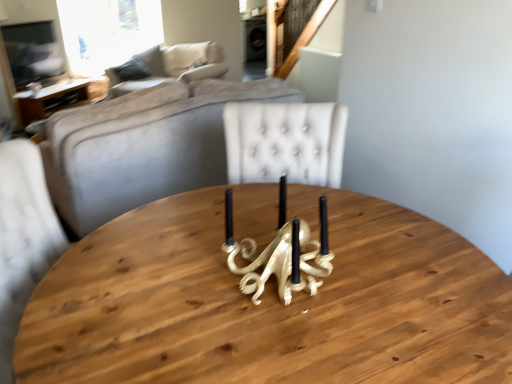
Question: From the image's perspective, would you say beige fabric couch at upper left is positioned over beige fabric pillow at upper center?

Choices:
 (A) yes
 (B) no

Answer: (B)

Question: From the image's perspective, is beige fabric couch at upper left located beneath beige fabric pillow at upper center?

Choices:
 (A) yes
 (B) no

Answer: (A)

Question: Is beige fabric couch at upper left beside beige fabric pillow at upper center?

Choices:
 (A) no
 (B) yes

Answer: (B)

Question: From a real-world perspective, is beige fabric couch at upper left physically above beige fabric pillow at upper center?

Choices:
 (A) yes
 (B) no

Answer: (B)

Question: Could you tell me if beige fabric couch at upper left is facing beige fabric pillow at upper center?

Choices:
 (A) no
 (B) yes

Answer: (A)

Question: Is beige fabric couch at upper left behind beige fabric pillow at upper center?

Choices:
 (A) no
 (B) yes

Answer: (A)

Question: Does wooden table at left lie in front of beige fabric pillow at upper center?

Choices:
 (A) no
 (B) yes

Answer: (B)

Question: Is wooden table at left outside beige fabric pillow at upper center?

Choices:
 (A) yes
 (B) no

Answer: (A)

Question: Considering the relative sizes of wooden table at left and beige fabric pillow at upper center in the image provided, is wooden table at left smaller than beige fabric pillow at upper center?

Choices:
 (A) yes
 (B) no

Answer: (B)

Question: Could you tell me if wooden table at left is facing beige fabric pillow at upper center?

Choices:
 (A) yes
 (B) no

Answer: (B)

Question: Considering the relative sizes of wooden table at left and beige fabric pillow at upper center in the image provided, is wooden table at left thinner than beige fabric pillow at upper center?

Choices:
 (A) no
 (B) yes

Answer: (A)

Question: Can you confirm if wooden table at left is bigger than beige fabric pillow at upper center?

Choices:
 (A) no
 (B) yes

Answer: (B)

Question: Would you say gold metallic octopus at center is outside wooden table at left?

Choices:
 (A) no
 (B) yes

Answer: (B)